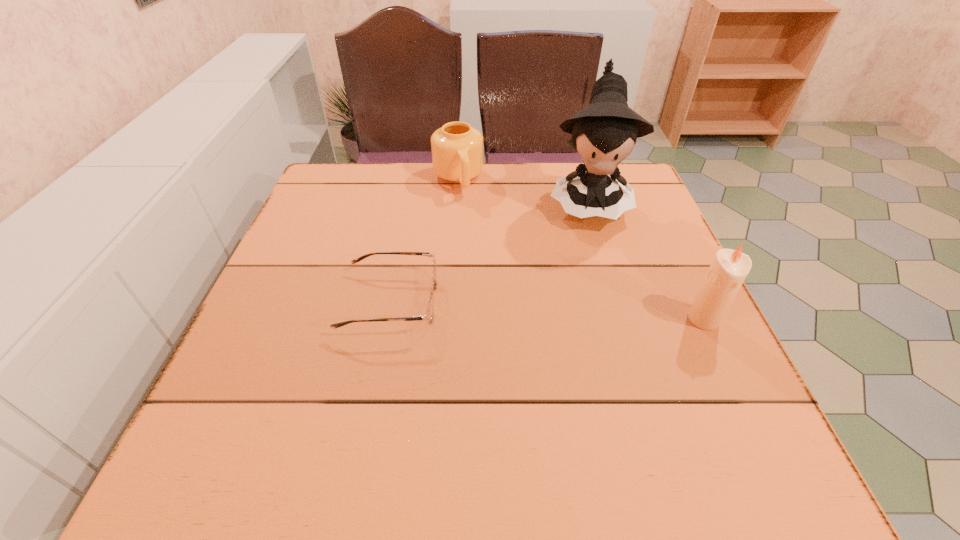
Where is `vacant space that's between the candle and the second shortest object`? The image size is (960, 540). vacant space that's between the candle and the second shortest object is located at coordinates (581, 249).

Find the location of a particular element. free spot between the spectacles and the doll is located at coordinates (489, 252).

Where is `free space between the spectacles and the candle`? This screenshot has height=540, width=960. free space between the spectacles and the candle is located at coordinates (547, 310).

You are a GUI agent. You are given a task and a screenshot of the screen. Output one action in this format:
    pyautogui.click(x=<x>, y=<y>)
    Task: Click on the free space between the doll and the shortest object
    
    Given the screenshot: What is the action you would take?
    pyautogui.click(x=489, y=252)

This screenshot has width=960, height=540. I want to click on vacant space that is in between the tallest object and the second tallest object, so click(645, 260).

Identify the location of vacant area that lies between the third tallest object and the spectacles. (424, 241).

The width and height of the screenshot is (960, 540). Identify the location of vacant area that lies between the candle and the doll. (645, 260).

Identify the location of object that is the second nearest to the mug. (429, 316).

I want to click on object that ranks as the closest to the second tallest object, so click(604, 133).